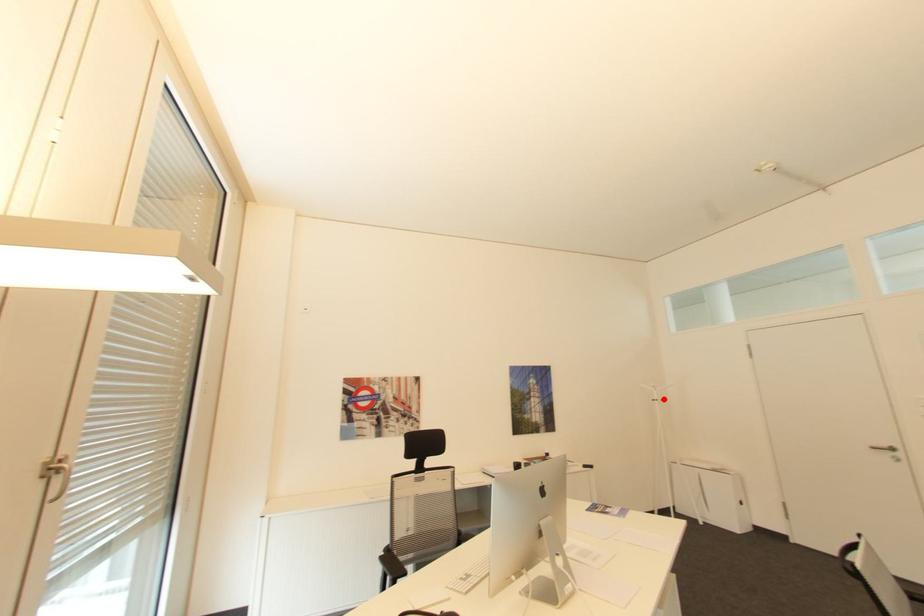
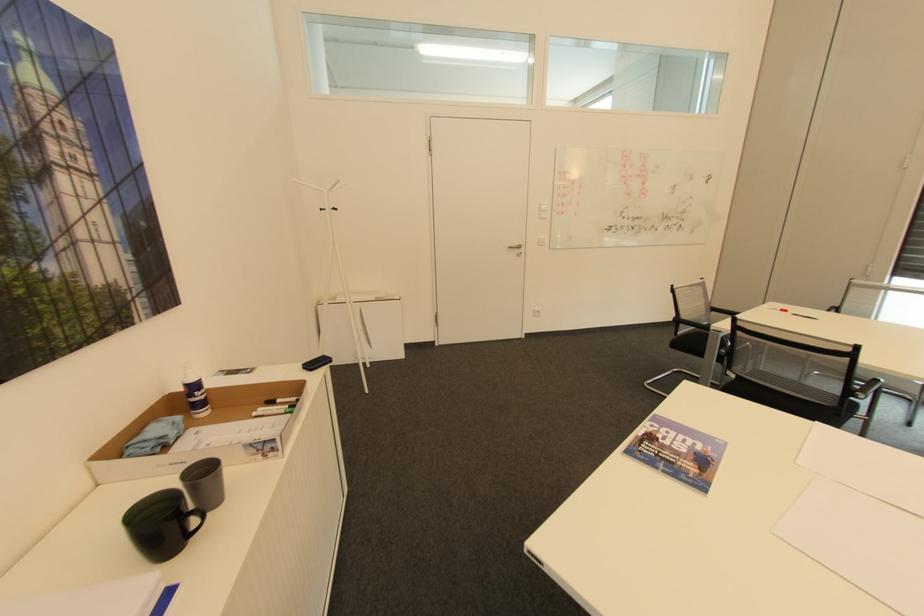
The point at the highlighted location is marked in the first image. Where is the corresponding point in the second image?

(333, 208)